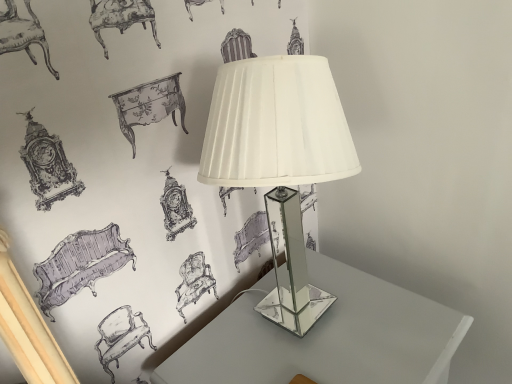
At what (x,y) coordinates should I click in order to perform the action: click on vacant area on top of clear glass table at center (from a real-world perspective). Please return your answer as a coordinate pair (x, y). The height and width of the screenshot is (384, 512). Looking at the image, I should click on (321, 330).